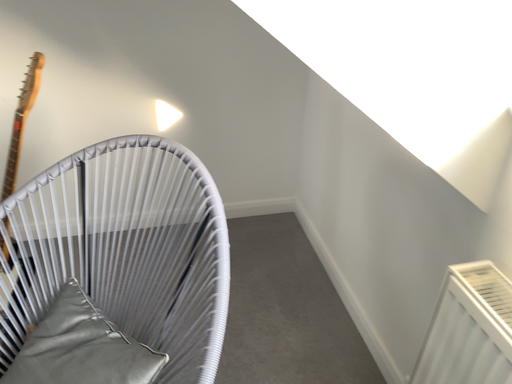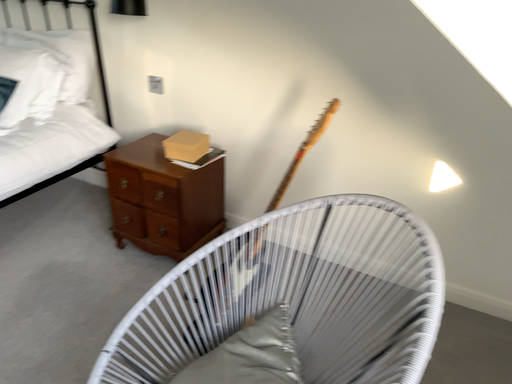
Question: How did the camera likely rotate when shooting the video?

Choices:
 (A) rotated downward
 (B) rotated upward

Answer: (B)